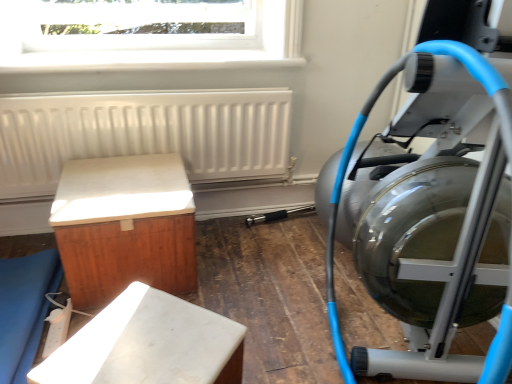
You are a GUI agent. You are given a task and a screenshot of the screen. Output one action in this format:
    pyautogui.click(x=<x>, y=<y>)
    Task: Click on the free space to the left of silver metallic stationary bicycle at right
    The height and width of the screenshot is (384, 512).
    Given the screenshot: What is the action you would take?
    pyautogui.click(x=271, y=329)